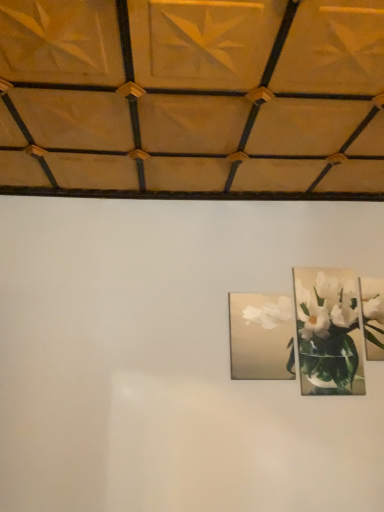
Question: Is metallic silver frame at upper right, marked as the 2th picture frame in a right-to-left arrangement, taller than metallic silver picture frame at upper right, the third picture frame when ordered from left to right?

Choices:
 (A) yes
 (B) no

Answer: (A)

Question: From a real-world perspective, does metallic silver frame at upper right, which is the 2th picture frame in left-to-right order, stand above metallic silver picture frame at upper right, the first picture frame when ordered from right to left?

Choices:
 (A) no
 (B) yes

Answer: (A)

Question: From the image's perspective, is metallic silver frame at upper right, which is the 2th picture frame in left-to-right order, beneath metallic silver picture frame at upper right, the third picture frame when ordered from left to right?

Choices:
 (A) yes
 (B) no

Answer: (A)

Question: Is metallic silver frame at upper right, which is the 2th picture frame in left-to-right order, smaller than metallic silver picture frame at upper right, the third picture frame when ordered from left to right?

Choices:
 (A) no
 (B) yes

Answer: (A)

Question: Does metallic silver frame at upper right, which is the 2th picture frame in left-to-right order, lie in front of metallic silver picture frame at upper right, the third picture frame when ordered from left to right?

Choices:
 (A) no
 (B) yes

Answer: (B)

Question: Do you think metallic silver picture frame at upper right, the first picture frame when ordered from right to left, is within matte silver picture frame at center, which appears as the third picture frame when viewed from the right, or outside of it?

Choices:
 (A) outside
 (B) inside

Answer: (A)

Question: In terms of height, does metallic silver picture frame at upper right, the third picture frame when ordered from left to right, look taller or shorter compared to matte silver picture frame at center, which appears as the third picture frame when viewed from the right?

Choices:
 (A) tall
 (B) short

Answer: (A)

Question: Is point (367, 346) positioned closer to the camera than point (286, 312)?

Choices:
 (A) closer
 (B) farther

Answer: (A)

Question: Relative to matte silver picture frame at center, which appears as the third picture frame when viewed from the right, is metallic silver picture frame at upper right, the first picture frame when ordered from right to left, in front or behind?

Choices:
 (A) front
 (B) behind

Answer: (B)

Question: Is metallic silver frame at upper right, marked as the 2th picture frame in a right-to-left arrangement, wider or thinner than metallic silver picture frame at upper right, the third picture frame when ordered from left to right?

Choices:
 (A) thin
 (B) wide

Answer: (A)

Question: Would you say metallic silver frame at upper right, which is the 2th picture frame in left-to-right order, is to the left or to the right of metallic silver picture frame at upper right, the first picture frame when ordered from right to left, in the picture?

Choices:
 (A) left
 (B) right

Answer: (A)

Question: Considering the positions of metallic silver frame at upper right, marked as the 2th picture frame in a right-to-left arrangement, and metallic silver picture frame at upper right, the third picture frame when ordered from left to right, in the image, is metallic silver frame at upper right, marked as the 2th picture frame in a right-to-left arrangement, taller or shorter than metallic silver picture frame at upper right, the third picture frame when ordered from left to right,?

Choices:
 (A) tall
 (B) short

Answer: (A)

Question: Do you think metallic silver frame at upper right, marked as the 2th picture frame in a right-to-left arrangement, is within metallic silver picture frame at upper right, the third picture frame when ordered from left to right, or outside of it?

Choices:
 (A) outside
 (B) inside

Answer: (A)

Question: Based on their positions, is metallic silver picture frame at upper right, the third picture frame when ordered from left to right, located to the left or right of metallic silver frame at upper right, marked as the 2th picture frame in a right-to-left arrangement?

Choices:
 (A) left
 (B) right

Answer: (B)

Question: In the image, is metallic silver picture frame at upper right, the third picture frame when ordered from left to right, positioned in front of or behind metallic silver frame at upper right, marked as the 2th picture frame in a right-to-left arrangement?

Choices:
 (A) behind
 (B) front

Answer: (A)